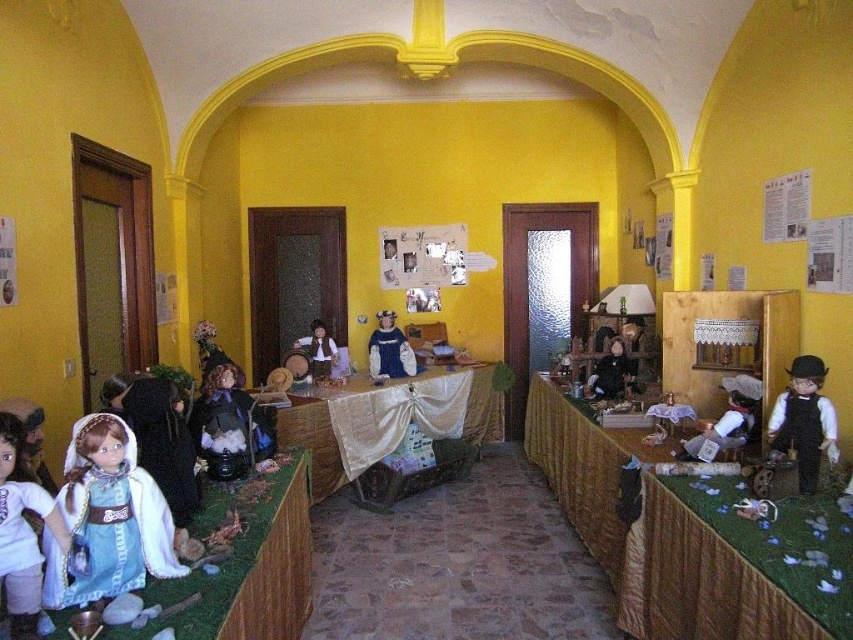
Question: Estimate the real-world distances between objects in this image. Which object is closer to the wooden doll at center?

Choices:
 (A) matte black doll at lower right
 (B) matte black doll at center
 (C) velvet doll at center

Answer: (C)

Question: Which object is closer to the camera taking this photo?

Choices:
 (A) wooden table at right
 (B) white lace cloth at center
 (C) matte black overalls at lower right
 (D) matte black doll at lower right

Answer: (C)

Question: Can you confirm if wooden table at right is thinner than white lace cloth at center?

Choices:
 (A) no
 (B) yes

Answer: (B)

Question: Among these points, which one is farthest from the camera?

Choices:
 (A) (326, 339)
 (B) (413, 413)
 (C) (204, 577)

Answer: (A)

Question: Does matte black doll at lower right appear on the right side of matte black doll at center?

Choices:
 (A) no
 (B) yes

Answer: (B)

Question: Is matte white doll at lower left to the left of wooden doll at center from the viewer's perspective?

Choices:
 (A) yes
 (B) no

Answer: (A)